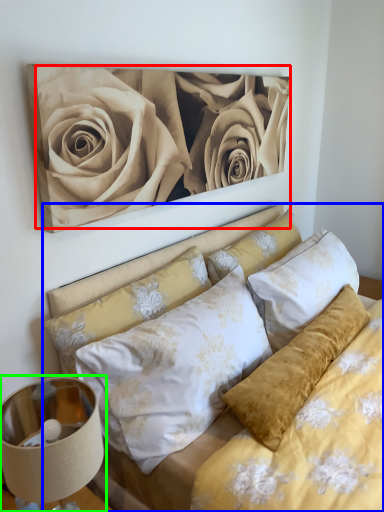
Question: Estimate the real-world distances between objects in this image. Which object is farther from rose (highlighted by a red box), bed (highlighted by a blue box) or lamp (highlighted by a green box)?

Choices:
 (A) bed
 (B) lamp

Answer: (B)